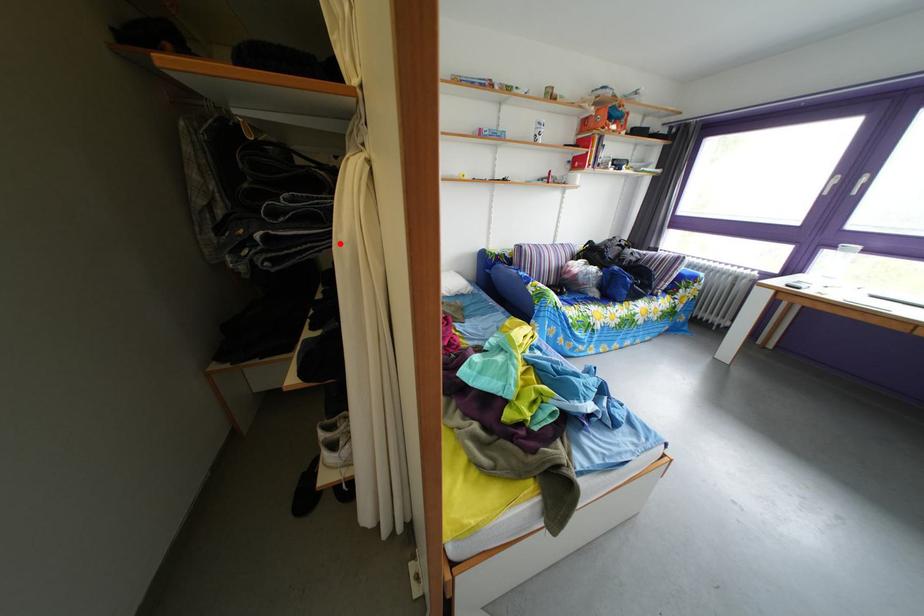
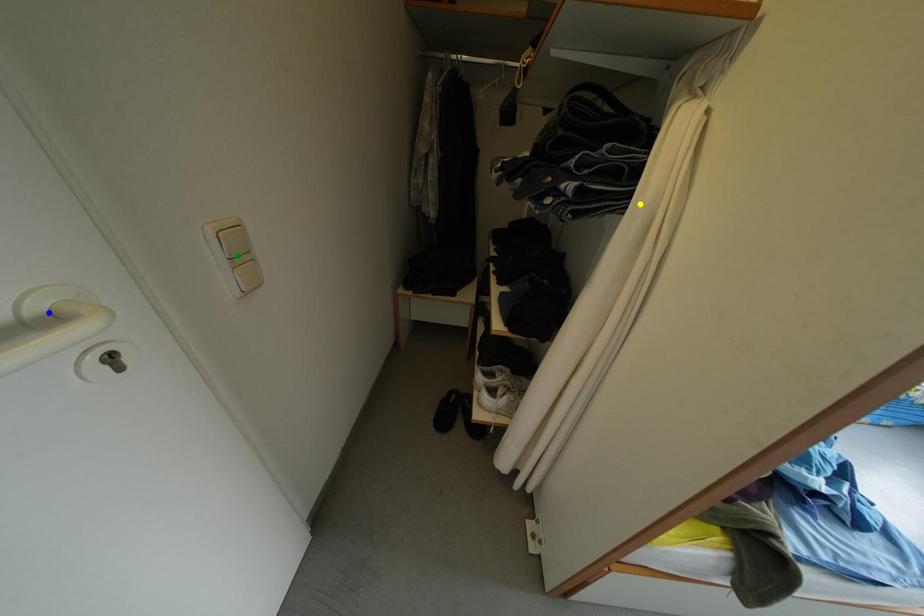
Question: I am providing you with two images of the same scene from different viewpoints. A red point is marked on the first image. You are given multiple points on the second image. Which point in image 2 represents the same 3d spot as the red point in image 1?

Choices:
 (A) blue point
 (B) green point
 (C) yellow point

Answer: (C)